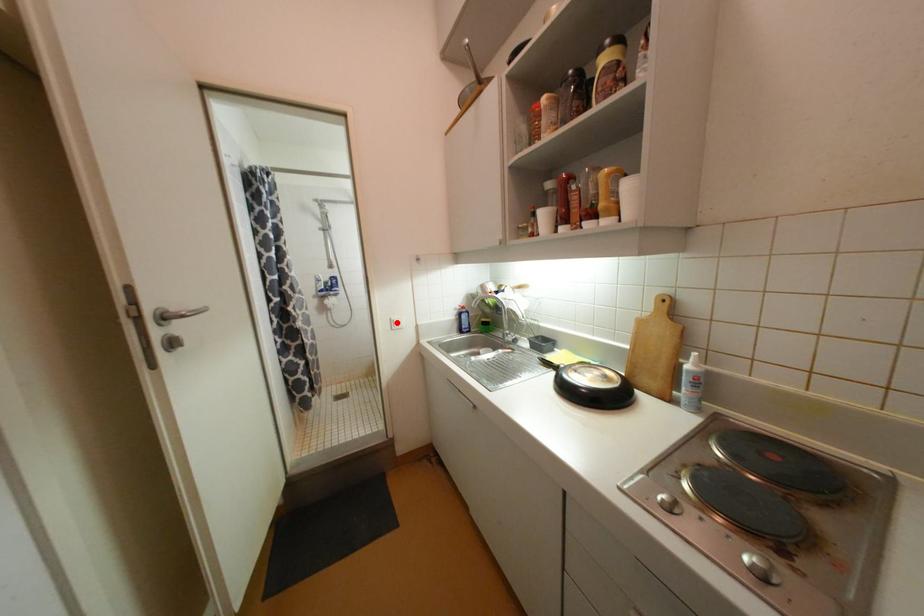
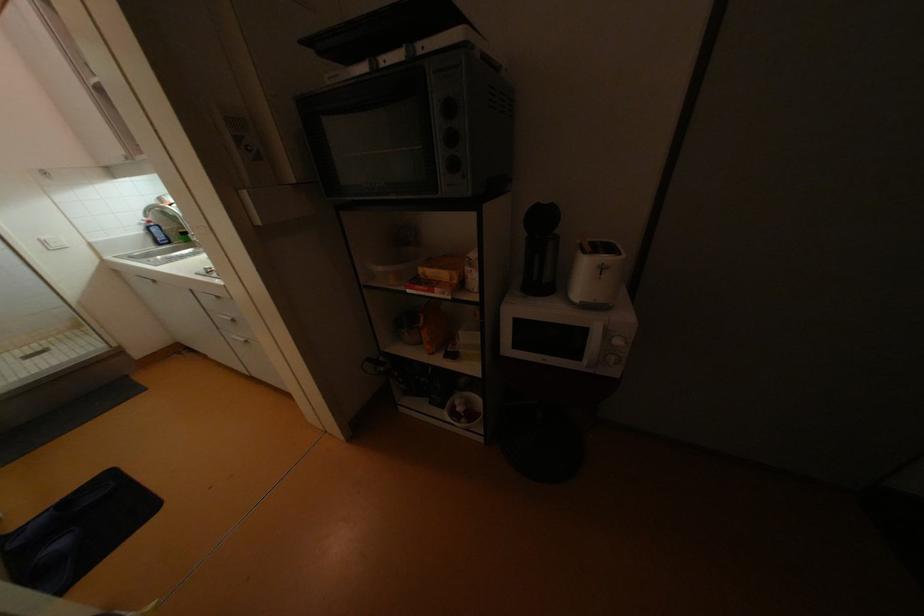
The point at the highlighted location is marked in the first image. Where is the corresponding point in the second image?

(49, 243)